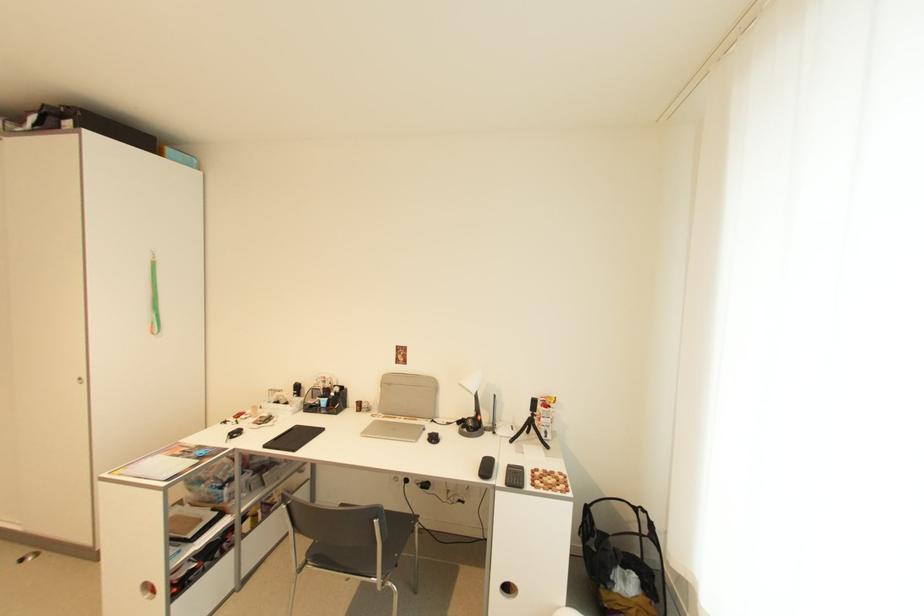
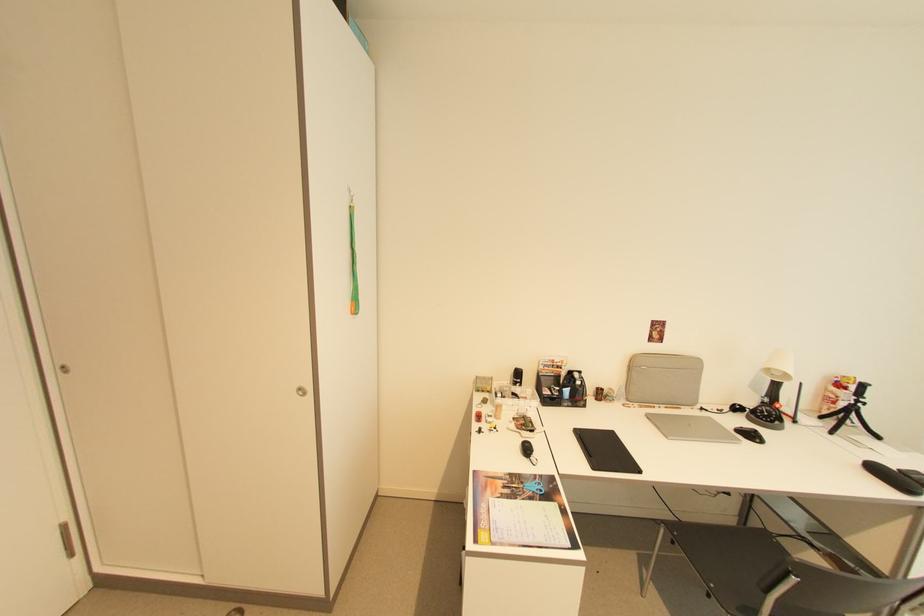
In the second image, find the point that corresponds to [393,384] in the first image.

(638, 366)